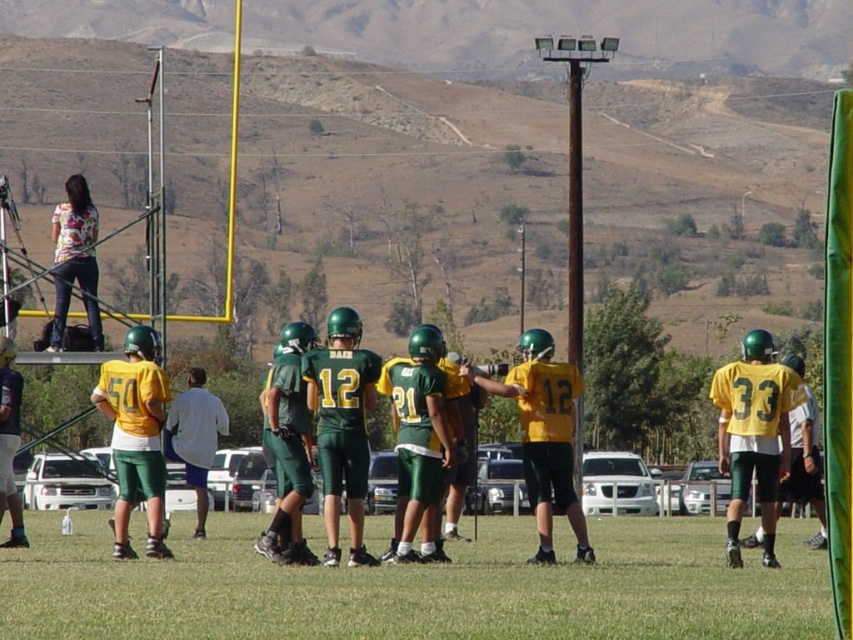
You are a photographer standing on the field during the football game. You want to take a photo that includes both the green grass at lower center and the white fabric shirt at center. Which object should you focus on first to ensure both are in sharp focus?

The green grass at lower center is closer to the viewer than the white fabric shirt at center. To ensure both are in sharp focus, focus on the green grass at lower center first since it is closer, and the depth of field will extend to include the white fabric shirt at center.

You are a photographer positioned at the edge of the football field. You want to take a photo that includes both the green grass at lower center and the white fabric shirt at center. Based on their positions, which object should you adjust your camera angle to focus on first to ensure both are in frame?

The green grass at lower center is to the right of the white fabric shirt at center. To include both in the frame, you should first focus on the white fabric shirt at center and then adjust the camera angle to the right to include the green grass at lower center.